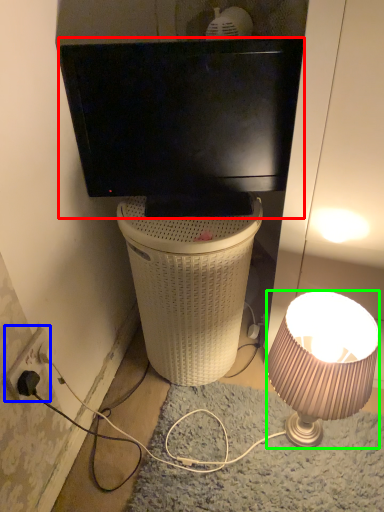
Question: Based on their relative distances, which object is farther from television (highlighted by a red box)? Choose from power outlet (highlighted by a blue box) and lamp (highlighted by a green box).

Choices:
 (A) power outlet
 (B) lamp

Answer: (A)